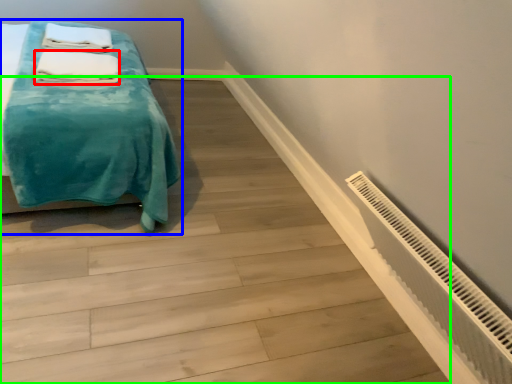
Question: Which object is the farthest from bath towel (highlighted by a red box)? Choose among these: bed (highlighted by a blue box) or stairwell (highlighted by a green box).

Choices:
 (A) bed
 (B) stairwell

Answer: (B)